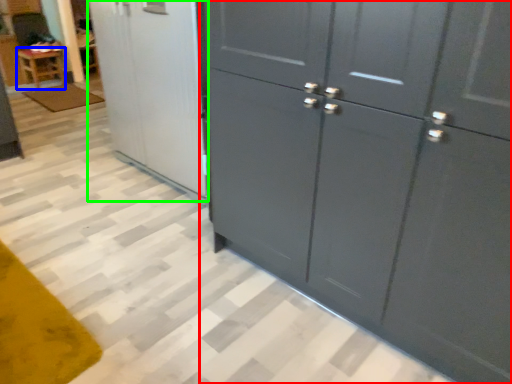
Question: Which object is the farthest from cupboard (highlighted by a red box)? Choose among these: furniture (highlighted by a blue box) or screen door (highlighted by a green box).

Choices:
 (A) furniture
 (B) screen door

Answer: (A)